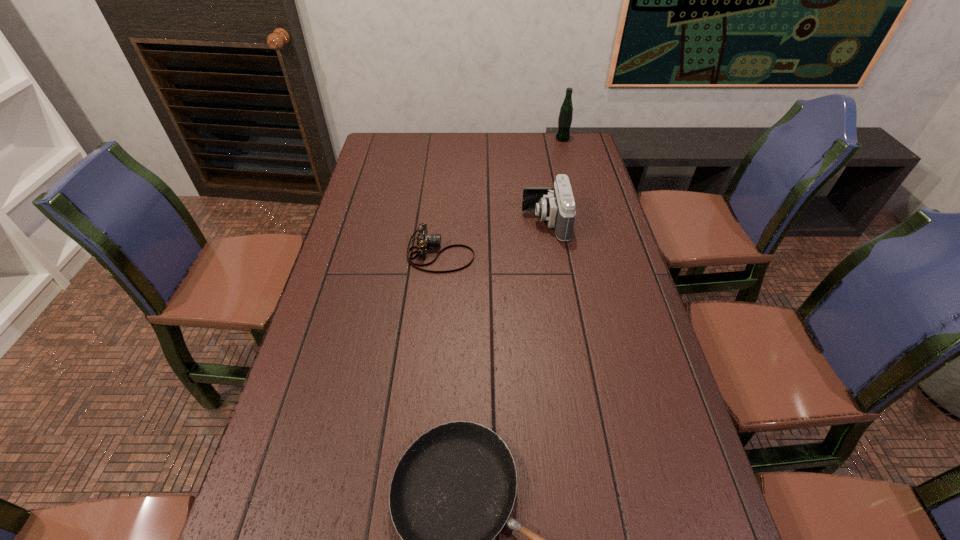
In order to click on vacant region located 0.160m on the front-facing side of the left camera in this screenshot , I will do `click(527, 254)`.

I want to click on object located in the far edge section of the desktop, so click(566, 111).

This screenshot has width=960, height=540. What are the coordinates of `beer bottle that is at the right edge` in the screenshot? It's located at (566, 111).

Where is `camera that is at the right edge`? The height and width of the screenshot is (540, 960). camera that is at the right edge is located at coordinates (556, 205).

Image resolution: width=960 pixels, height=540 pixels. Find the location of `object at the far right corner`. object at the far right corner is located at coordinates (566, 111).

Locate an element on the screen. vacant point at the far edge is located at coordinates (434, 135).

This screenshot has height=540, width=960. In the image, there is a desktop. In order to click on vacant space at the left edge in this screenshot , I will do `click(356, 197)`.

Where is `vacant space at the far left corner`? The height and width of the screenshot is (540, 960). vacant space at the far left corner is located at coordinates pyautogui.click(x=372, y=158).

The width and height of the screenshot is (960, 540). Find the location of `vacant space at the far right corner of the desktop`. vacant space at the far right corner of the desktop is located at coordinates (576, 147).

Find the location of a particular element. Image resolution: width=960 pixels, height=540 pixels. free space between the second shortest object and the second tallest object is located at coordinates (x=493, y=238).